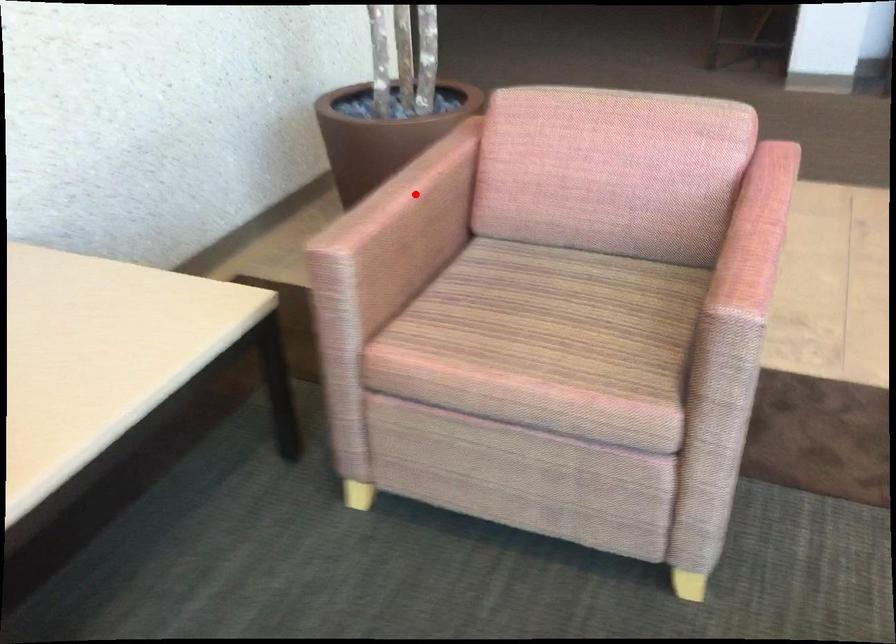
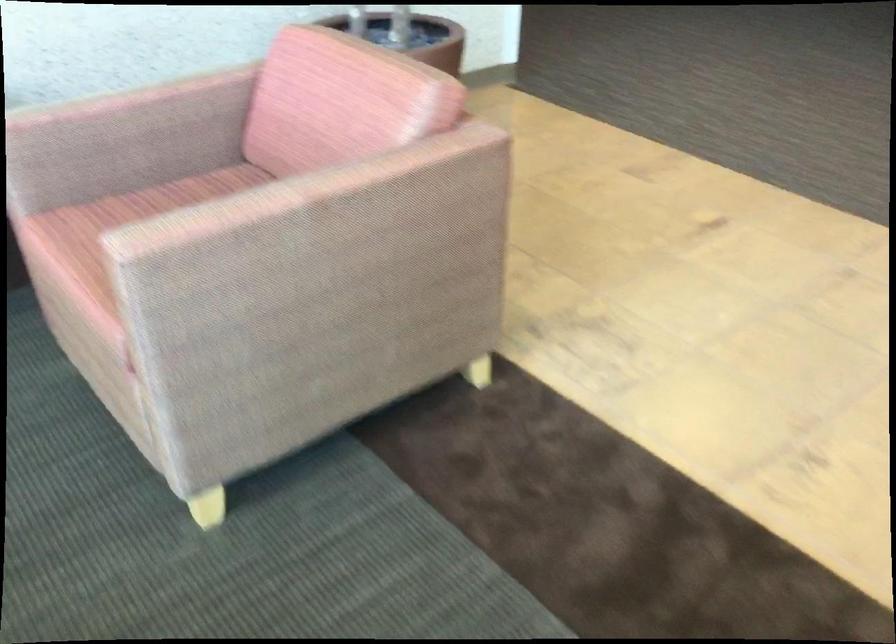
In the second image, find the point that corresponds to the highlighted location in the first image.

(121, 98)